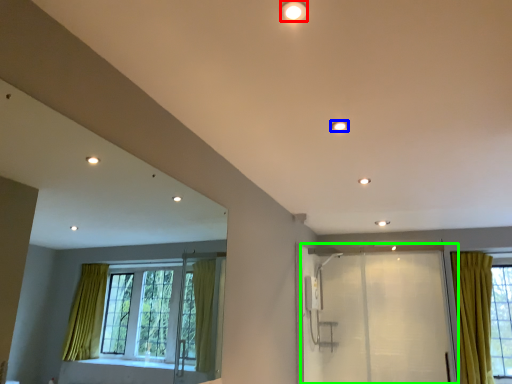
Question: Estimate the real-world distances between objects in this image. Which object is farther from lighting (highlighted by a red box), lighting (highlighted by a blue box) or screen door (highlighted by a green box)?

Choices:
 (A) lighting
 (B) screen door

Answer: (B)